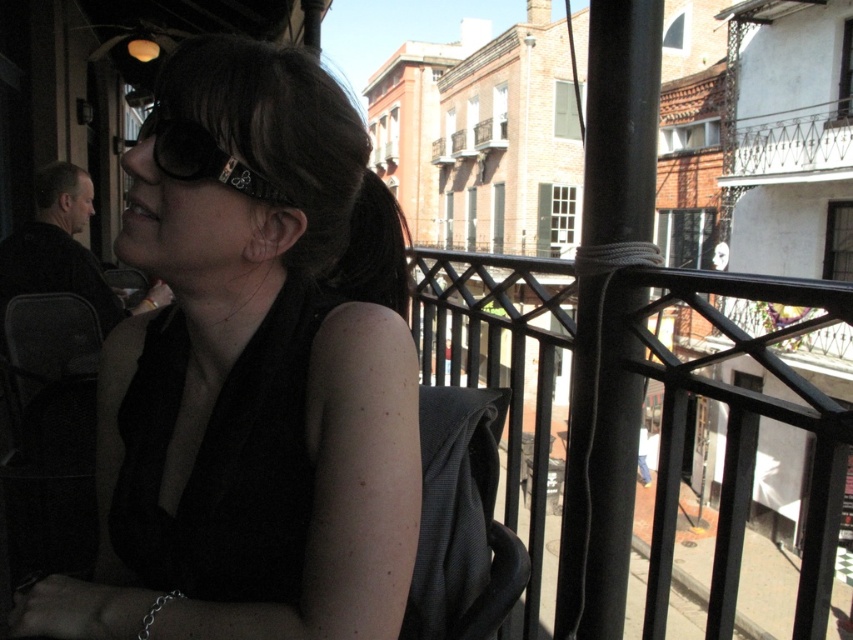
You are a photographer trying to capture the matte black sunglasses at upper left in the scene. The sunglasses are located at coordinates point (252, 372). If you are standing on the balcony, where should you position yourself to ensure the sunglasses are in the frame?

The matte black sunglasses at upper left are located at point (252, 372), so you should position yourself on the balcony facing towards the upper left area to capture them in the frame.

You are standing on the balcony and want to lean against the black metal railing at center. Considering your height is 1.6 meters, can you comfortably reach the railing?

The black metal railing at center is 1.12 meters away from the viewer. Since your height is 1.6 meters, you can comfortably reach the railing as it is within your arm length.

You are a guest at this balcony and want to place a small potted plant between the black metal railing at center and the matte black goggles at upper left. Which object should the plant be closer to?

The plant should be placed closer to the matte black goggles at upper left because the black metal railing at center is to the right of the matte black goggles at upper left, so the goggles are on the left side and the railing is on the right side. Therefore, placing the plant between them would mean it is closer to the goggles on the left.